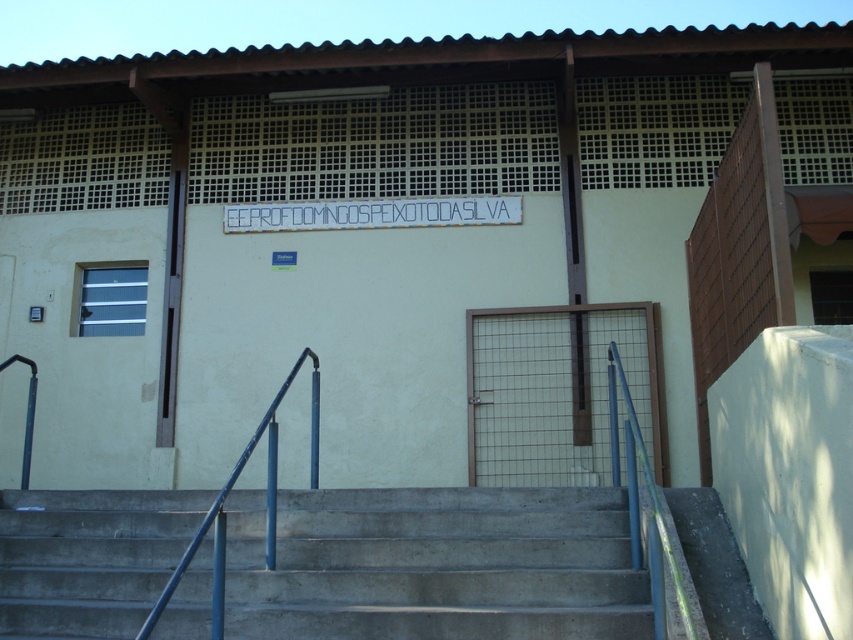
Which is more to the left, concrete/steps at center or blue metallic handrail at center?

From the viewer's perspective, blue metallic handrail at center appears more on the left side.

Locate an element on the screen. concrete/steps at center is located at coordinates (434, 564).

Between point (254, 632) and point (312, 444), which one is positioned behind?

The point (312, 444) is behind.

The width and height of the screenshot is (853, 640). In order to click on concrete/steps at center in this screenshot , I will do [x=434, y=564].

Which of these two, white plastic sign at center or blue metallic handrail at center, stands shorter?

Standing shorter between the two is white plastic sign at center.

Who is more distant from viewer, (515, 214) or (151, 620)?

The point (515, 214) is more distant.

Does point (309, 211) lie behind point (283, 387)?

Yes.

Where is `white plastic sign at center`? This screenshot has width=853, height=640. white plastic sign at center is located at coordinates (372, 212).

Is point (502, 516) farther from viewer compared to point (436, 225)?

No, (502, 516) is in front of (436, 225).

Between concrete/steps at center and white plastic sign at center, which one has less height?

white plastic sign at center is shorter.

Is point (569, 541) positioned behind point (360, 211)?

No, (569, 541) is in front of (360, 211).

The width and height of the screenshot is (853, 640). Find the location of `concrete/steps at center`. concrete/steps at center is located at coordinates 434,564.